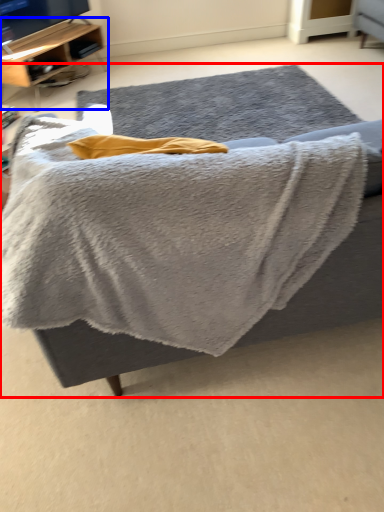
Question: Which object appears closest to the camera in this image, furniture (highlighted by a red box) or shelf (highlighted by a blue box)?

Choices:
 (A) furniture
 (B) shelf

Answer: (A)